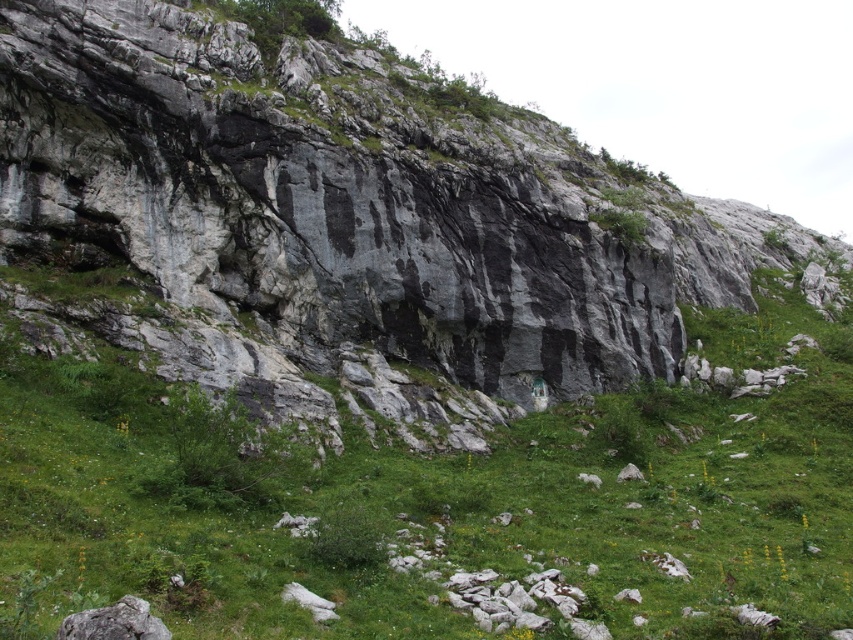
In the scene shown: Does gray rock formation at center have a greater width compared to green grassy at center?

Indeed, gray rock formation at center has a greater width compared to green grassy at center.

Is point (349, 74) positioned behind point (477, 524)?

That is True.

Who is more distant from viewer, [519,172] or [190,636]?

The point [519,172] is more distant.

The image size is (853, 640). I want to click on gray rock formation at center, so click(334, 218).